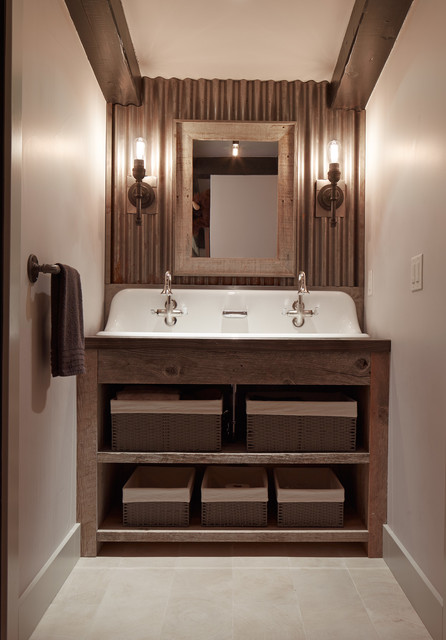
Locate an element on the screen. light is located at coordinates (337, 150), (235, 150), (144, 147).